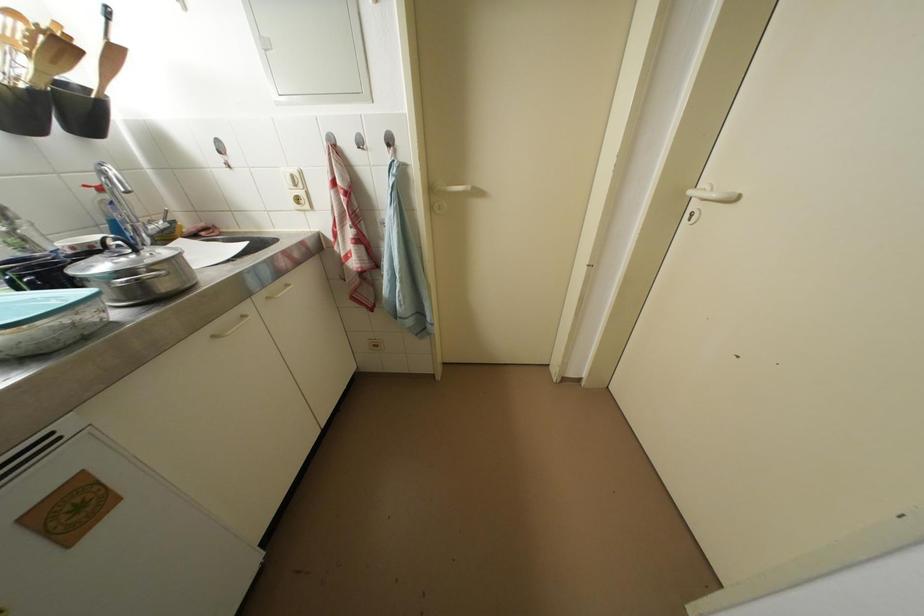
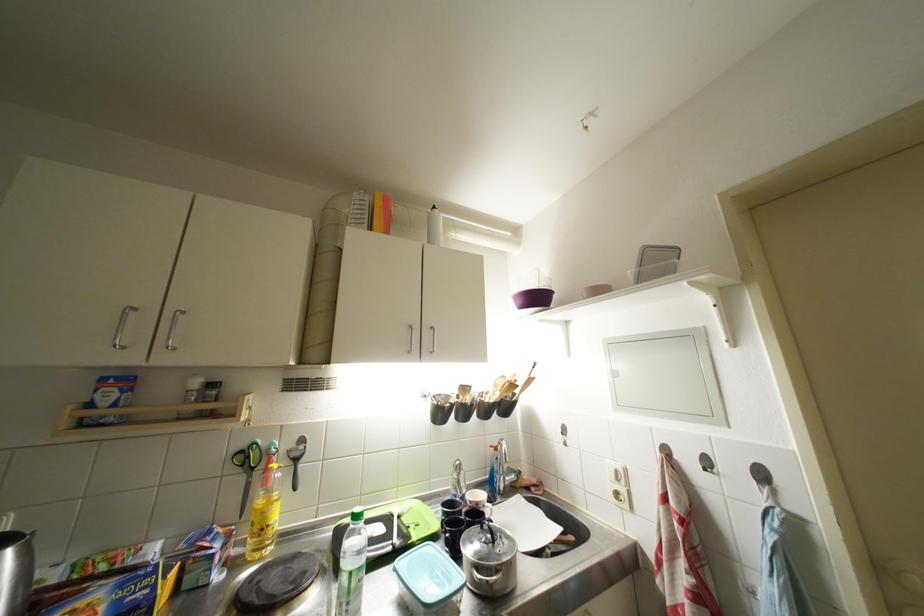
The point at (396, 144) is marked in the first image. Where is the corresponding point in the second image?

(769, 479)